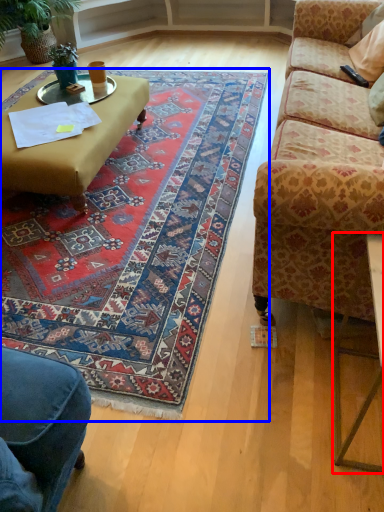
Question: Which object appears farthest to the camera in this image, table (highlighted by a red box) or mat (highlighted by a blue box)?

Choices:
 (A) table
 (B) mat

Answer: (B)